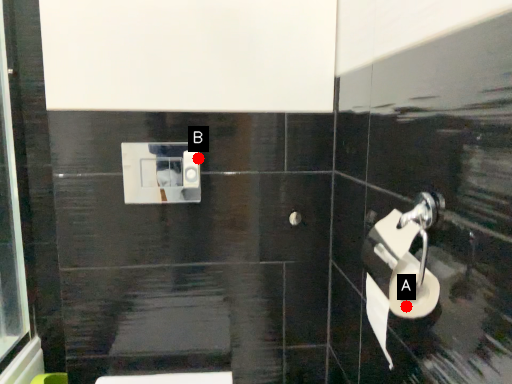
Question: Two points are circled on the image, labeled by A and B beside each circle. Which point is closer to the camera?

Choices:
 (A) A is closer
 (B) B is closer

Answer: (A)